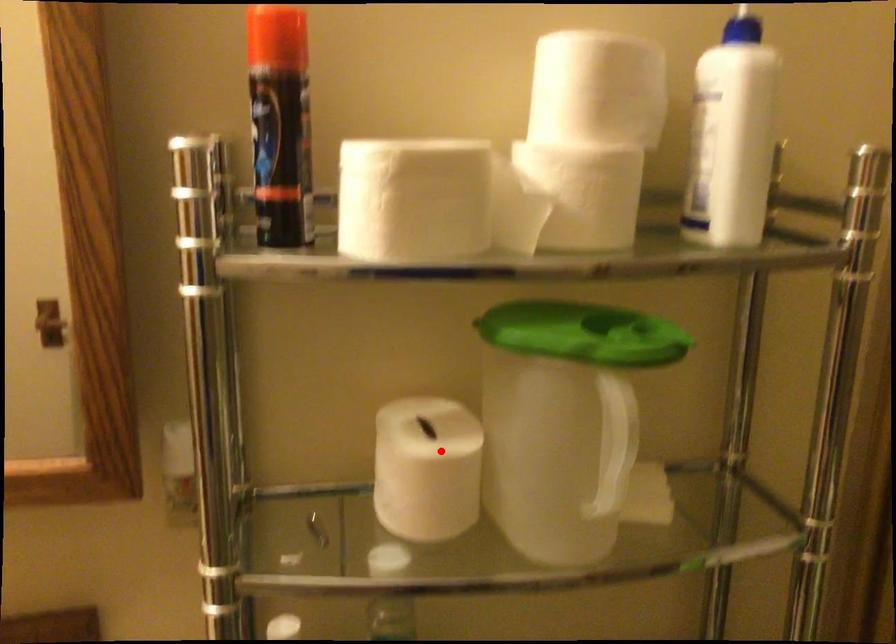
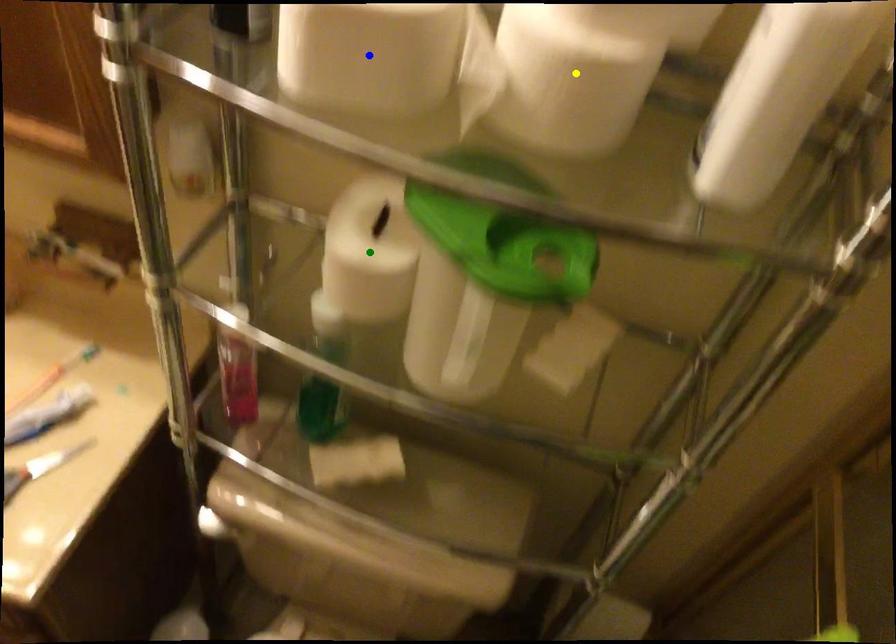
Question: I am providing you with two images of the same scene from different viewpoints. A red point is marked on the first image. You are given multiple points on the second image. Which mark in image 2 goes with the point in image 1?

Choices:
 (A) yellow point
 (B) blue point
 (C) green point

Answer: (C)